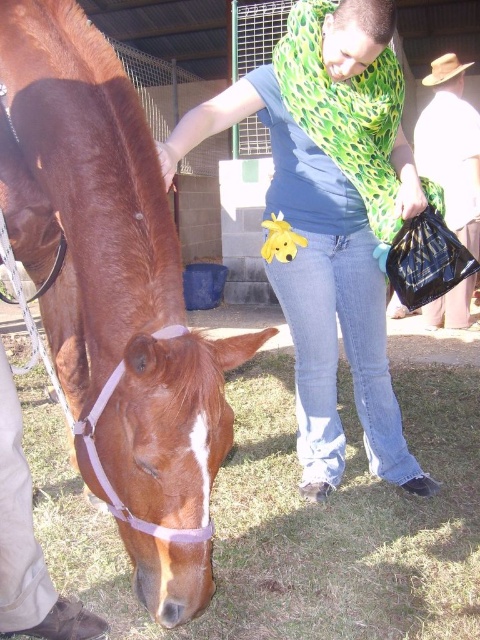
Question: Where is brown glossy horse at left located in relation to brown woven hat at upper right in the image?

Choices:
 (A) below
 (B) above

Answer: (A)

Question: Which object appears closest to the camera in this image?

Choices:
 (A) brown glossy horse at left
 (B) green leopard print scarf at center
 (C) brown grass at lower center

Answer: (A)

Question: Which point is closer to the camera?

Choices:
 (A) green leopard print scarf at center
 (B) brown glossy horse at left
 (C) brown grass at lower center

Answer: (B)

Question: Is the position of brown glossy horse at left more distant than that of brown woven hat at upper right?

Choices:
 (A) no
 (B) yes

Answer: (A)

Question: Which point is farther to the camera?

Choices:
 (A) (434, 99)
 (B) (3, 422)
 (C) (397, 374)
 (D) (399, 417)

Answer: (A)

Question: Is brown grass at lower center bigger than green leopard print scarf at center?

Choices:
 (A) yes
 (B) no

Answer: (A)